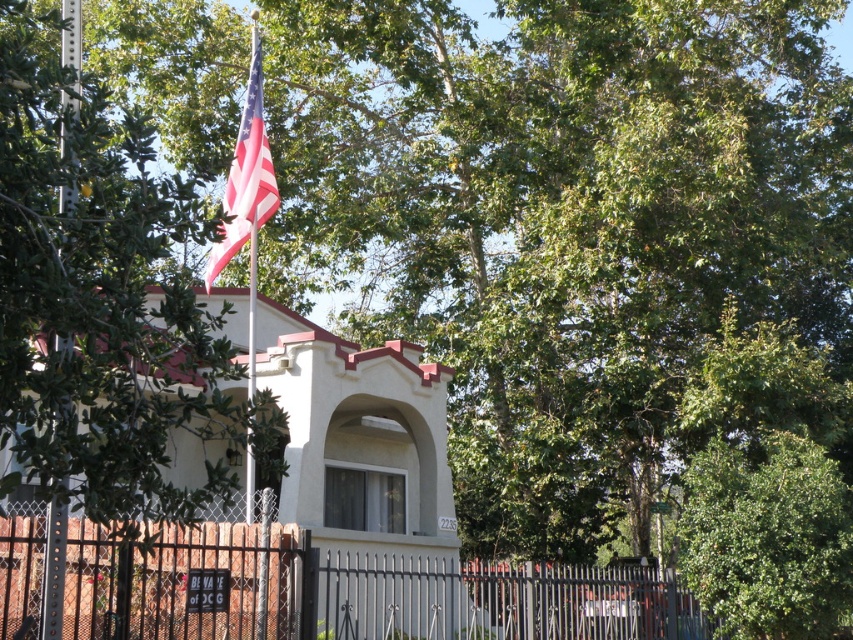
Between point (344, 570) and point (64, 566), which one is positioned behind?

The point (344, 570) is more distant.

Which is behind, point (628, 627) or point (64, 156)?

Point (628, 627)

You are a GUI agent. You are given a task and a screenshot of the screen. Output one action in this format:
    pyautogui.click(x=<x>, y=<y>)
    Task: Click on the metallic chain-link fence at lower center
    Image resolution: width=853 pixels, height=640 pixels.
    Given the screenshot: What is the action you would take?
    pyautogui.click(x=347, y=592)

Is american flag at upper center in front of metallic silver flag pole at left?

No, it is behind metallic silver flag pole at left.

Between american flag at upper center and metallic silver flag pole at left, which one appears on the right side from the viewer's perspective?

From the viewer's perspective, metallic silver flag pole at left appears more on the right side.

Is point (228, 209) less distant than point (65, 12)?

No, (228, 209) is behind (65, 12).

The image size is (853, 640). What are the coordinates of `american flag at upper center` in the screenshot? It's located at (247, 179).

This screenshot has height=640, width=853. Describe the element at coordinates (347, 592) in the screenshot. I see `metallic chain-link fence at lower center` at that location.

Does metallic chain-link fence at lower center appear on the right side of american flag at upper center?

Yes, metallic chain-link fence at lower center is to the right of american flag at upper center.

Does point (654, 595) come farther from viewer compared to point (253, 228)?

That is True.

Where is `metallic chain-link fence at lower center`? This screenshot has height=640, width=853. metallic chain-link fence at lower center is located at coordinates (347, 592).